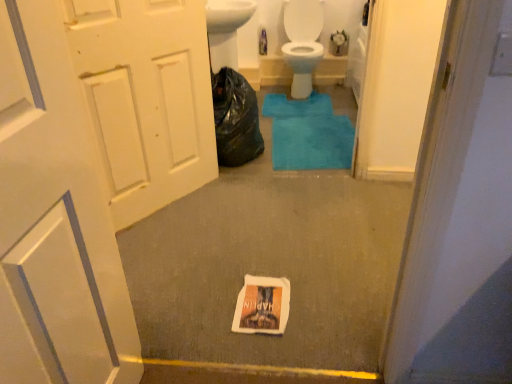
Where is `vacant area that lies between white matte door at left, the first door from the back, and white paper flyer at center`? The height and width of the screenshot is (384, 512). vacant area that lies between white matte door at left, the first door from the back, and white paper flyer at center is located at coordinates (202, 238).